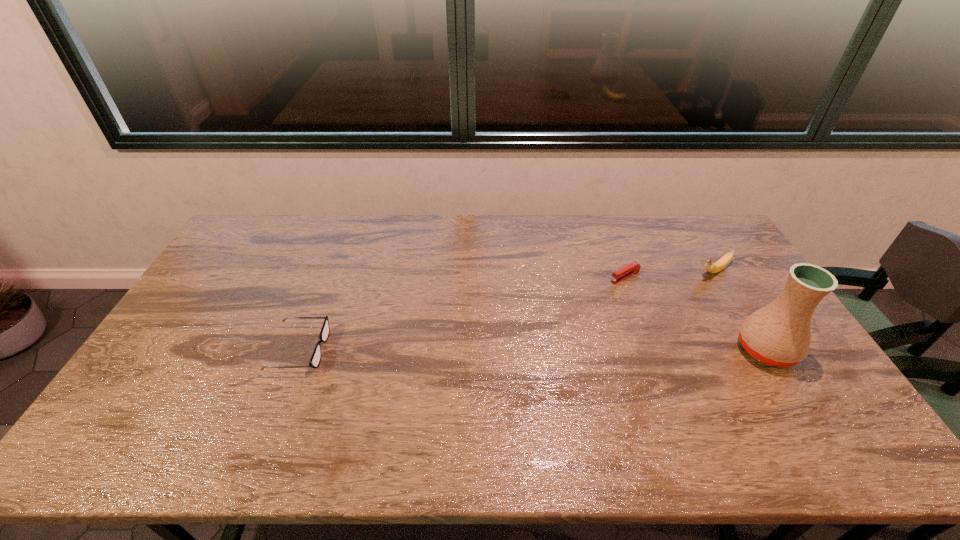
What are the coordinates of `free space on the desktop that is between the leftmost object and the tallest object and is positioned on the front-facing side of the stapler` in the screenshot? It's located at (483, 349).

This screenshot has height=540, width=960. Identify the location of vacant space on the desktop that is between the spectacles and the tallest object and is positioned at the stem of the second tallest object. (594, 349).